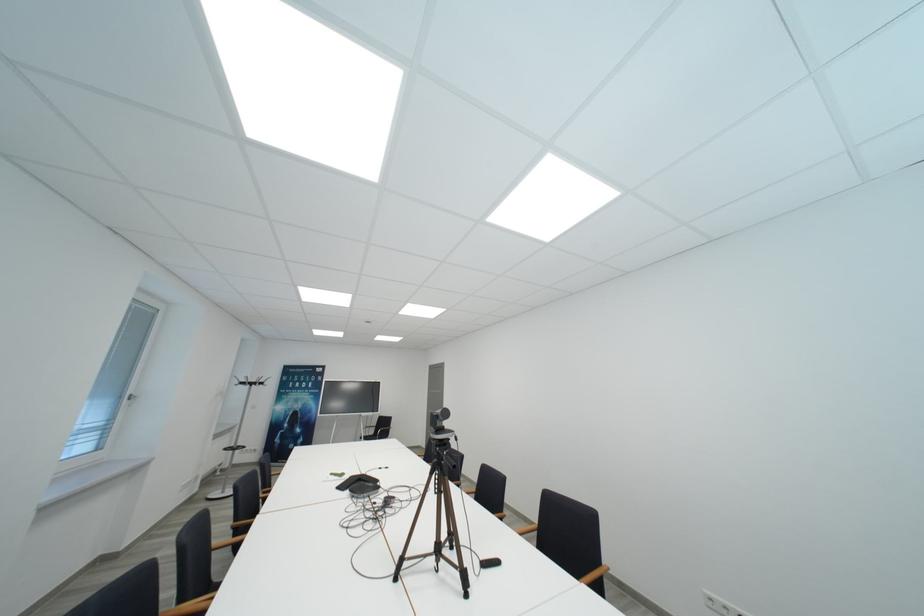
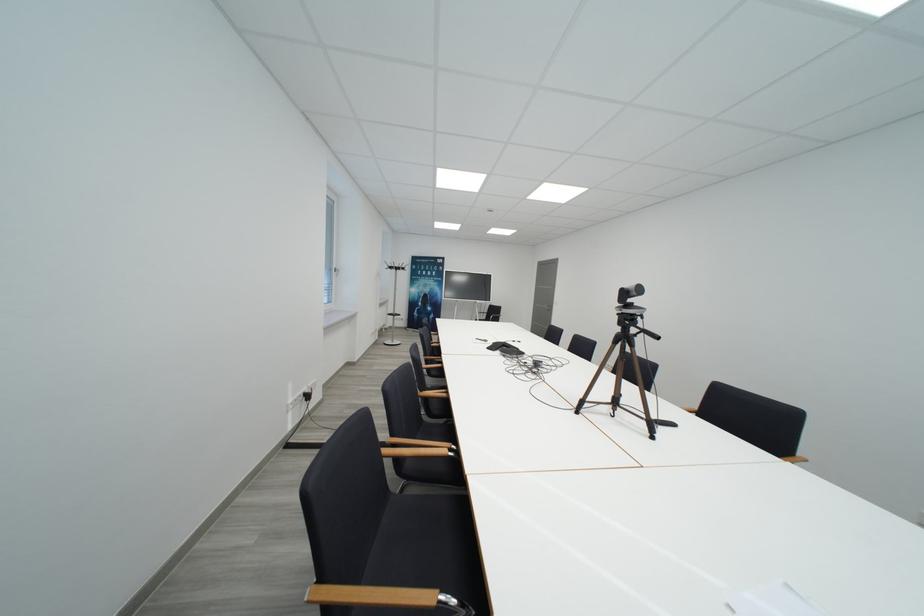
The point at (249, 386) is marked in the first image. Where is the corresponding point in the second image?

(397, 270)